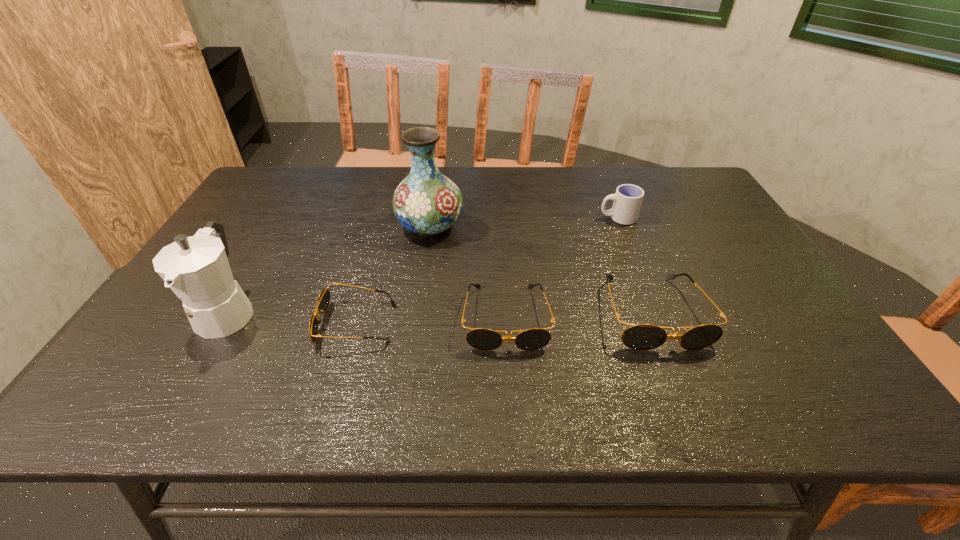
Considering the uniform spacing of sunglassess, where should an additional sunglasses be positioned on the right? Please locate a free spot. Please provide its 2D coordinates. Your answer should be formatted as a tuple, i.e. [(x, y)], where the tuple contains the x and y coordinates of a point satisfying the conditions above.

[(795, 308)]